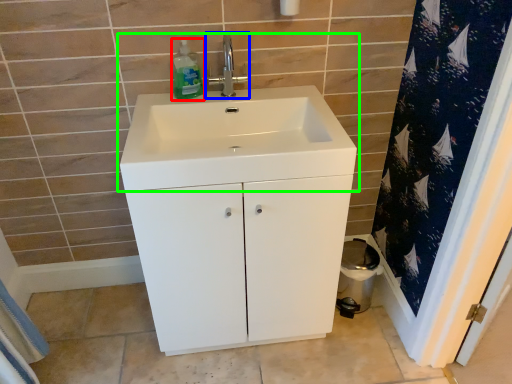
Question: Estimate the real-world distances between objects in this image. Which object is closer to cleaning product (highlighted by a red box), tap (highlighted by a blue box) or sink (highlighted by a green box)?

Choices:
 (A) tap
 (B) sink

Answer: (A)